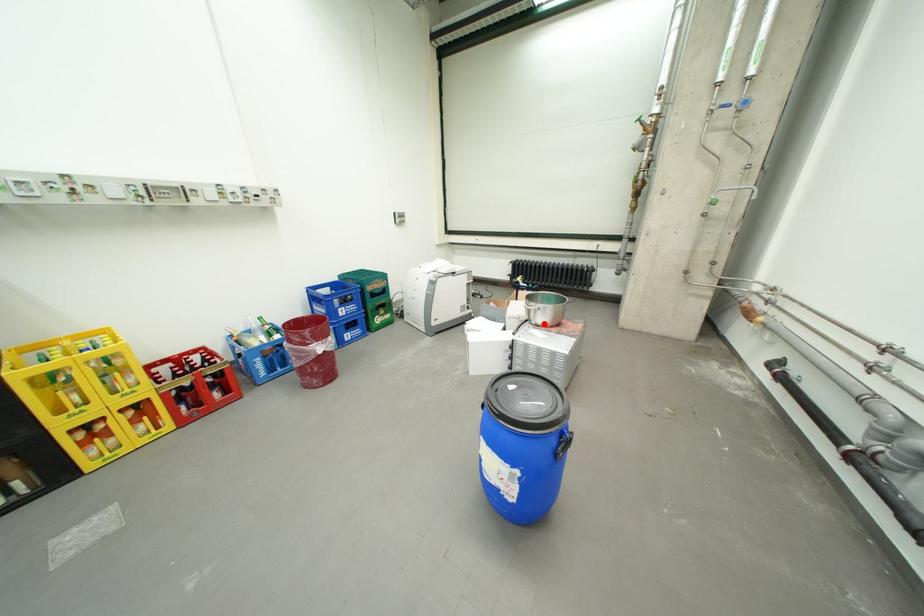
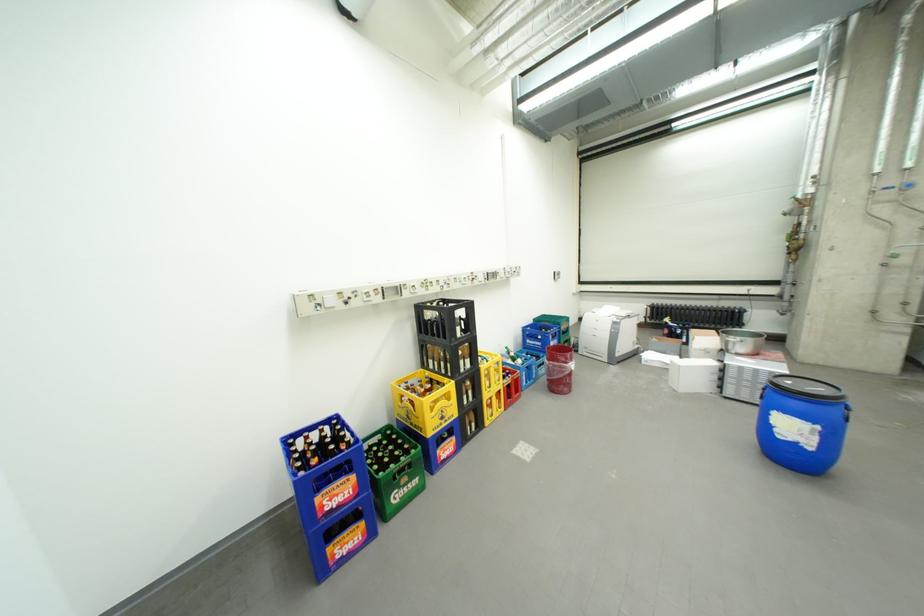
Question: A red point is marked in image1. In image2, is the corresponding 3D point closer to the camera or farther? Reply with the corresponding letter.

Choices:
 (A) The corresponding 3D point is closer.
 (B) The corresponding 3D point is farther.

Answer: (B)